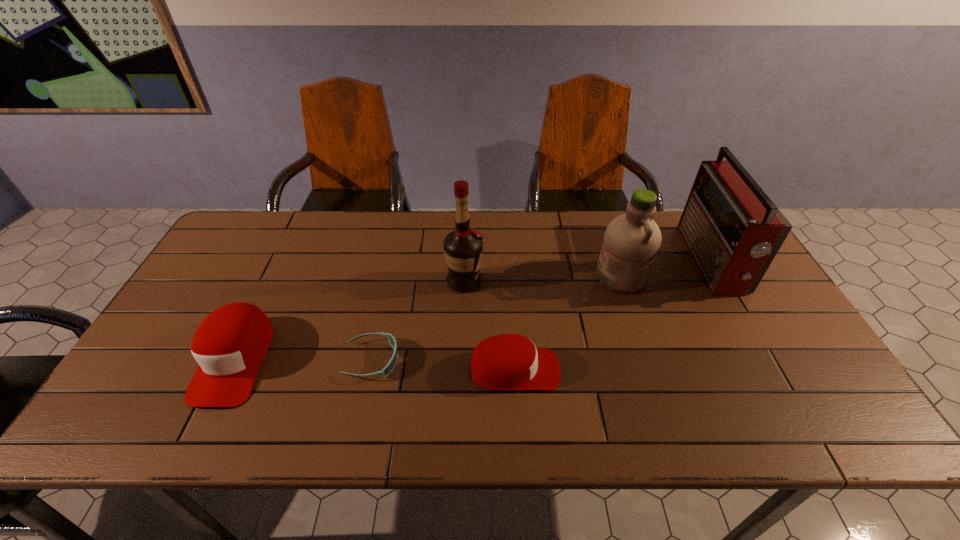
Locate an element on the screen. This screenshot has width=960, height=540. vacant point located on the front-facing side of the radio receiver is located at coordinates (562, 261).

Find the location of `vacant area situated on the front-facing side of the radio receiver`. vacant area situated on the front-facing side of the radio receiver is located at coordinates (584, 261).

At what (x,y) coordinates should I click in order to perform the action: click on vacant position located on the front-facing side of the radio receiver. Please return your answer as a coordinate pair (x, y). The height and width of the screenshot is (540, 960). Looking at the image, I should click on (581, 261).

Identify the location of free spot located 0.190m on the front and back of the liquor. (548, 282).

Locate an element on the screen. vacant space situated on the front label of the fifth object from left to right is located at coordinates (485, 276).

Where is `vacant space located 0.300m on the front label of the fifth object from left to right`? vacant space located 0.300m on the front label of the fifth object from left to right is located at coordinates (494, 276).

The image size is (960, 540). Identify the location of vacant space situated on the front label of the fifth object from left to right. (465, 276).

Image resolution: width=960 pixels, height=540 pixels. I want to click on vacant space located 0.150m on the front-facing side of the fifth object from right to left, so click(460, 360).

Where is `object at the far edge`? This screenshot has width=960, height=540. object at the far edge is located at coordinates (733, 230).

Where is `goggles that is at the near edge`? The width and height of the screenshot is (960, 540). goggles that is at the near edge is located at coordinates (388, 368).